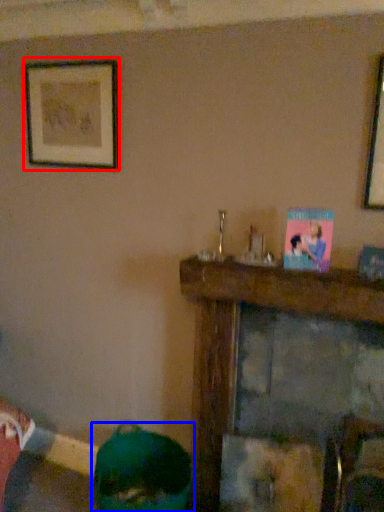
Question: Which point is further to the camera, picture frame (highlighted by a red box) or person (highlighted by a blue box)?

Choices:
 (A) picture frame
 (B) person

Answer: (A)